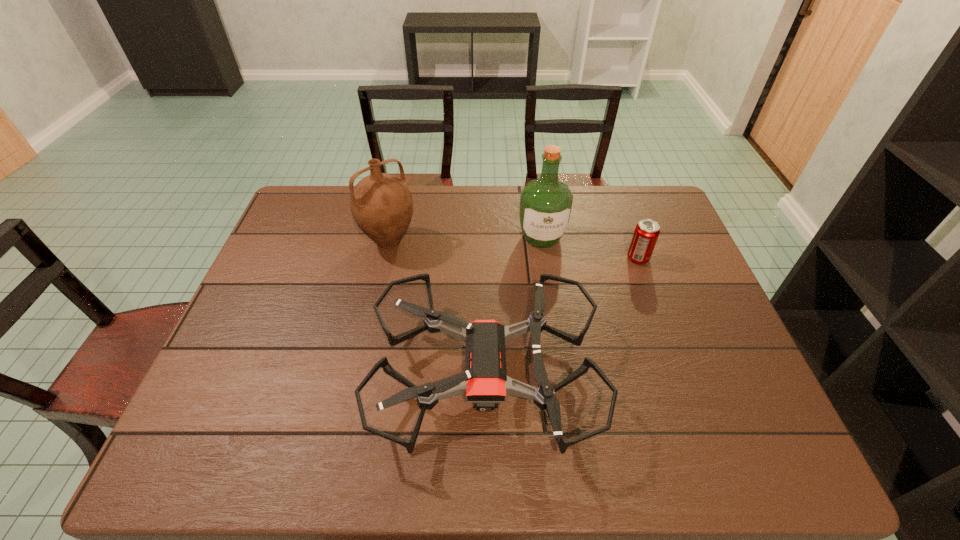
You are a GUI agent. You are given a task and a screenshot of the screen. Output one action in this format:
    pyautogui.click(x=<x>, y=<y>)
    Task: Click on the liquor
    The height and width of the screenshot is (540, 960).
    Given the screenshot: What is the action you would take?
    pyautogui.click(x=546, y=203)

The width and height of the screenshot is (960, 540). Identify the location of pitcher. (381, 204).

At what (x,y) coordinates should I click in order to perform the action: click on soda can. Please return your answer as a coordinate pair (x, y). This screenshot has width=960, height=540. Looking at the image, I should click on (647, 231).

The height and width of the screenshot is (540, 960). I want to click on drone, so click(x=485, y=382).

Where is `free location located 0.390m on the front-facing side of the liquor`? The width and height of the screenshot is (960, 540). free location located 0.390m on the front-facing side of the liquor is located at coordinates (560, 361).

What are the coordinates of `free space located on the front of the pitcher` in the screenshot? It's located at (364, 357).

Where is `free space located 0.130m on the back of the soda can`? The width and height of the screenshot is (960, 540). free space located 0.130m on the back of the soda can is located at coordinates (626, 224).

Where is `blank space located with the camera facing forward on the drone`? blank space located with the camera facing forward on the drone is located at coordinates (345, 373).

Locate an element on the screen. vacant area situated with the camera facing forward on the drone is located at coordinates (296, 373).

Locate an element on the screen. The height and width of the screenshot is (540, 960). vacant region located 0.380m with the camera facing forward on the drone is located at coordinates (218, 373).